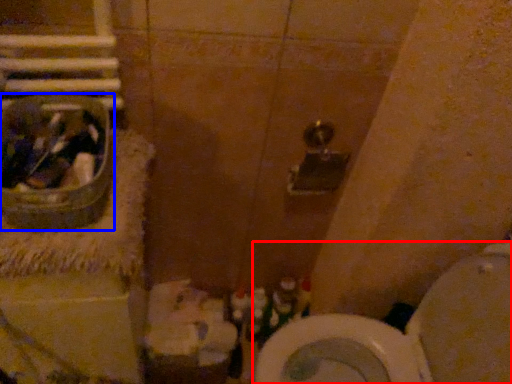
Question: Among these objects, which one is nearest to the camera, toilet (highlighted by a red box) or sink (highlighted by a blue box)?

Choices:
 (A) toilet
 (B) sink

Answer: (B)